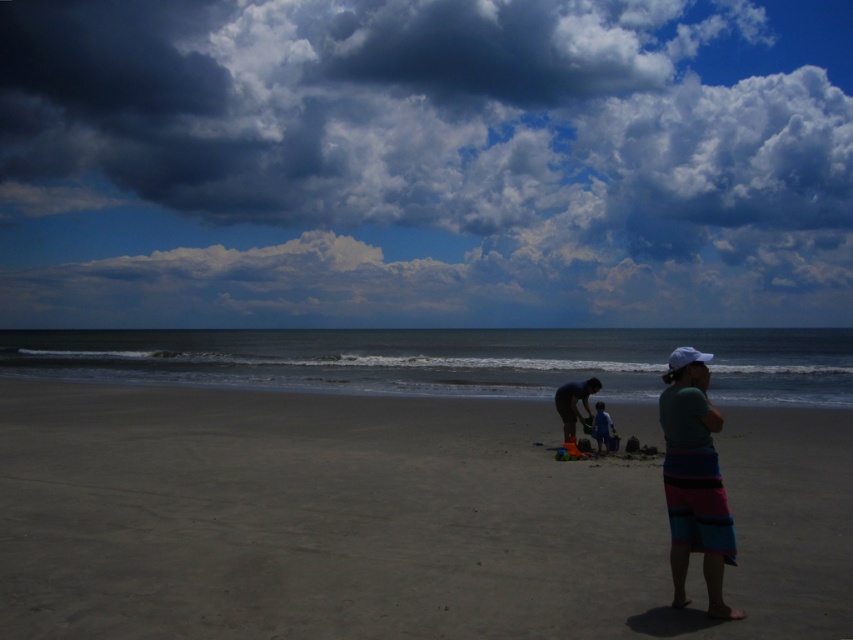
Is point (424, 205) closer to viewer compared to point (479, 506)?

That is False.

Identify the location of dark gray cloud at upper center. The image size is (853, 640). (424, 163).

Which is in front, point (689, 492) or point (589, 385)?

Point (689, 492) is more forward.

Does striped towel at right appear under matte black surfboard at lower center?

Actually, striped towel at right is above matte black surfboard at lower center.

Is point (720, 589) less distant than point (566, 387)?

Yes, it is.

Locate an element on the screen. striped towel at right is located at coordinates (694, 480).

Is smooth sand at center above blue fabric pants at center?

Actually, smooth sand at center is below blue fabric pants at center.

How distant is smooth sand at center from blue fabric pants at center?

A distance of 6.58 meters exists between smooth sand at center and blue fabric pants at center.

Is point (741, 564) in front of point (601, 445)?

Yes, it is in front of point (601, 445).

Locate an element on the screen. The height and width of the screenshot is (640, 853). smooth sand at center is located at coordinates [392, 518].